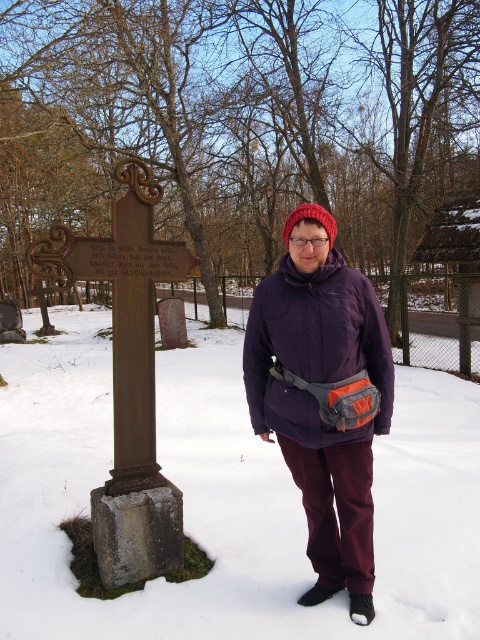
Does purple fleece jacket at center have a greater height compared to bronze stone cross at left?

Incorrect, purple fleece jacket at center's height is not larger of bronze stone cross at left's.

Between purple fleece jacket at center and bronze stone cross at left, which one has less height?

Standing shorter between the two is purple fleece jacket at center.

Consider the image. Who is more distant from viewer, [310,449] or [115,358]?

The point [115,358] is behind.

At what (x,y) coordinates should I click in order to perform the action: click on purple fleece jacket at center. Please return your answer as a coordinate pair (x, y). The image size is (480, 640). Looking at the image, I should click on (323, 396).